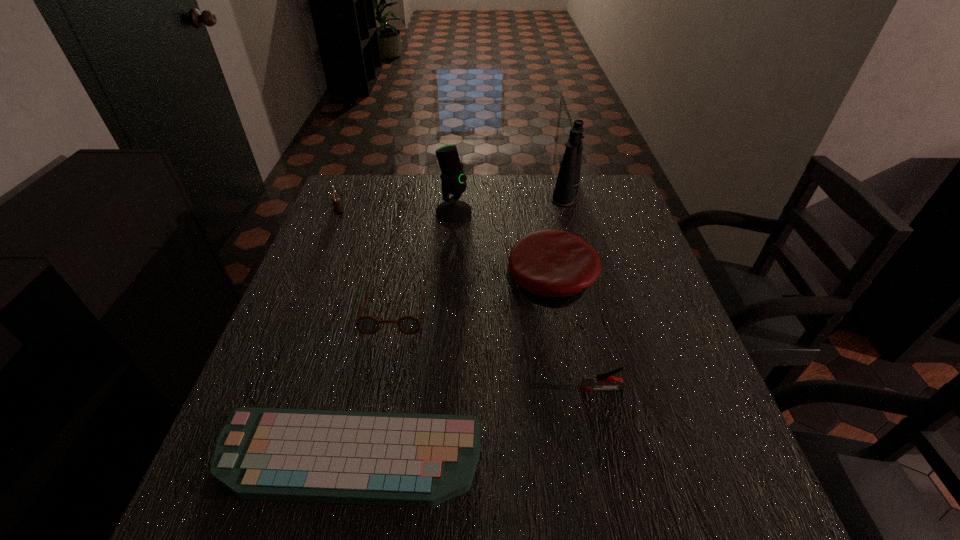
Find the location of `binoculars`. binoculars is located at coordinates (568, 178).

Where is `microphone`? Image resolution: width=960 pixels, height=540 pixels. microphone is located at coordinates (453, 181).

What are the coordinates of `cap` in the screenshot? It's located at (552, 268).

The height and width of the screenshot is (540, 960). I want to click on padlock, so tap(338, 209).

Locate an element on the screen. the sixth farthest object is located at coordinates click(588, 382).

You are a GUI agent. You are given a task and a screenshot of the screen. Output one action in this format:
    pyautogui.click(x=<x>, y=<y>)
    Task: Click on the fifth tallest object
    The height and width of the screenshot is (540, 960).
    Given the screenshot: What is the action you would take?
    pyautogui.click(x=588, y=382)

Locate an element on the screen. This screenshot has height=540, width=960. spectacles is located at coordinates (368, 325).

Identify the location of the nearest object. (323, 456).

The image size is (960, 540). I want to click on computer keyboard, so click(323, 456).

Locate an element on the screen. The image size is (960, 540). vacant space located 0.250m on the front of the binoculars is located at coordinates (585, 262).